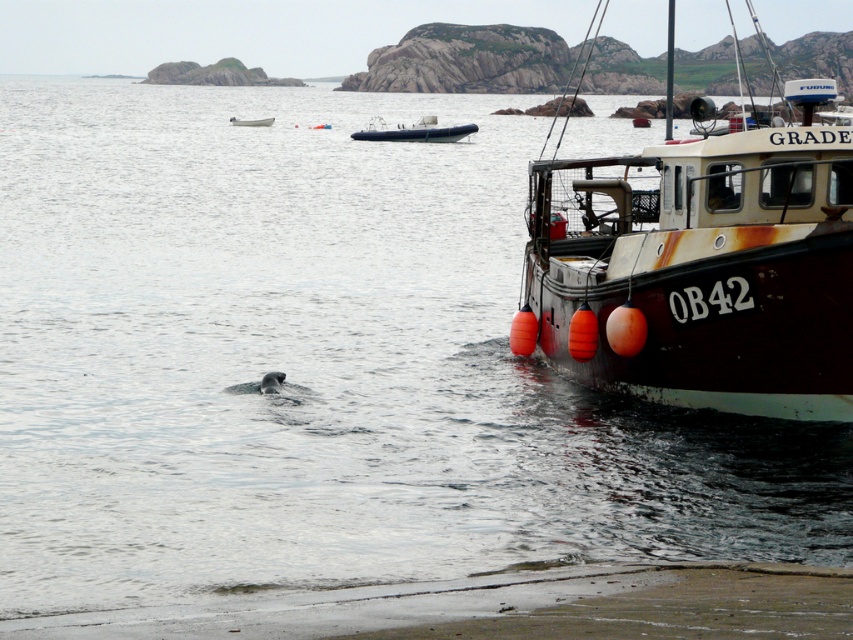
You are standing at the shore and want to take a photo of the point at coordinates (640, 368). The camera you have can focus up to 20 meters away. Will the point be in focus?

The point at coordinates (640, 368) is 18.86 meters from the camera, which is within the camera focus range of 20 meters. Therefore, the point will be in focus.

You are standing at the point marked by the coordinates point (508, 605) in the coastal scene. Based on the image description, what type of terrain are you currently standing on?

The point (508, 605) corresponds to sandy beach at lower left, so you are standing on a sandy beach.

You are a photographer planning to take a wide shot of the scene. The rusty metal boat at right and the sandy beach at lower left are both in your frame. Considering their sizes, which object will occupy more of the photo?

The rusty metal boat at right is bigger than the sandy beach at lower left, so it will occupy more space in the photo.